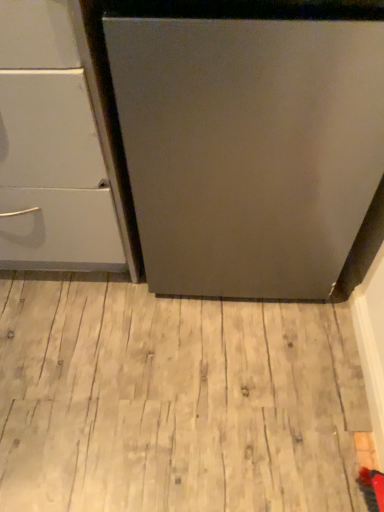
This screenshot has width=384, height=512. I want to click on empty space that is ontop of light wood flooring at center (from a real-world perspective), so pyautogui.click(x=168, y=367).